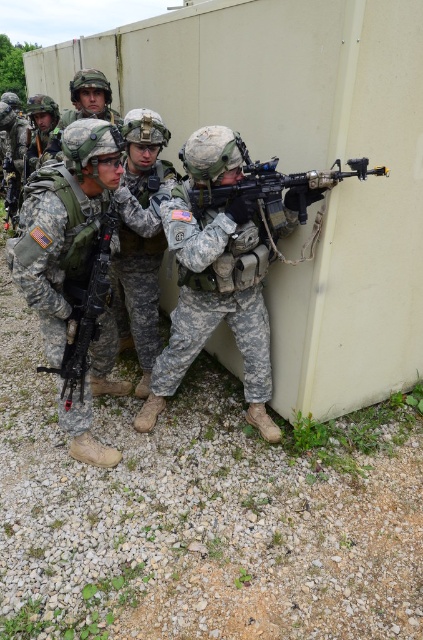
Between point (96, 237) and point (134, 324), which one is positioned in front?

Point (96, 237) is in front.

In the scene shown: Is camouflage uniform at left closer to camera compared to camouflage uniform at center?

Yes, camouflage uniform at left is in front of camouflage uniform at center.

Which is in front, point (36, 241) or point (153, 317)?

Point (36, 241) is more forward.

At what (x,y) coordinates should I click in order to perform the action: click on camouflage uniform at left. Please return your answer as a coordinate pair (x, y). This screenshot has width=423, height=640. Looking at the image, I should click on (71, 264).

Describe the element at coordinates (137, 253) in the screenshot. I see `camouflage uniform at center` at that location.

Can you confirm if camouflage uniform at center is thinner than matte black rifle at center?

Yes, camouflage uniform at center is thinner than matte black rifle at center.

Where is `camouflage uniform at center`? This screenshot has width=423, height=640. camouflage uniform at center is located at coordinates (137, 253).

Can you confirm if matte black rifle at center is wider than matte black machine gun at center?

Yes.

In the scene shown: Who is higher up, matte black rifle at center or matte black machine gun at center?

matte black rifle at center is above.

Which is behind, point (329, 182) or point (68, 339)?

Positioned behind is point (68, 339).

Find the location of a particular element. Image resolution: width=423 pixels, height=640 pixels. matte black rifle at center is located at coordinates (275, 188).